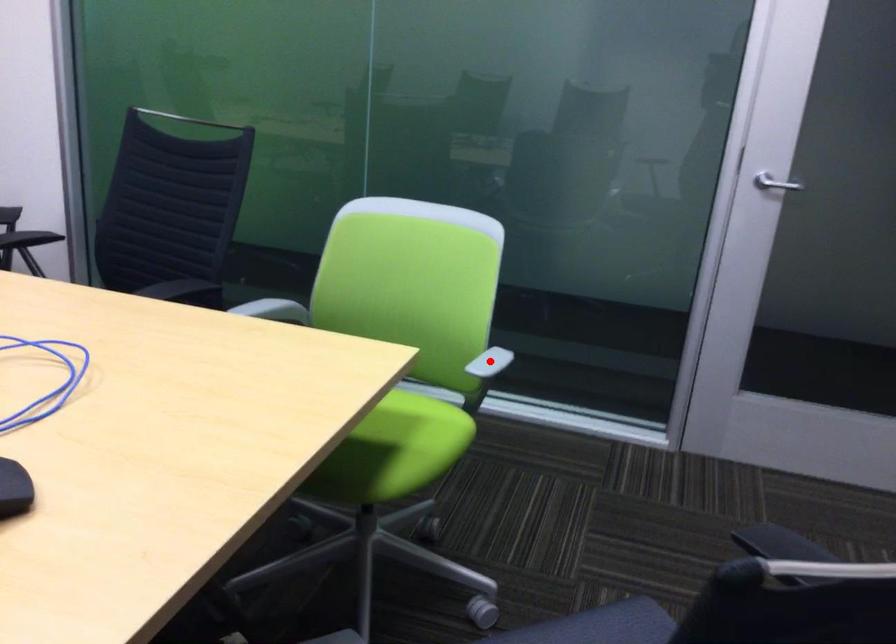
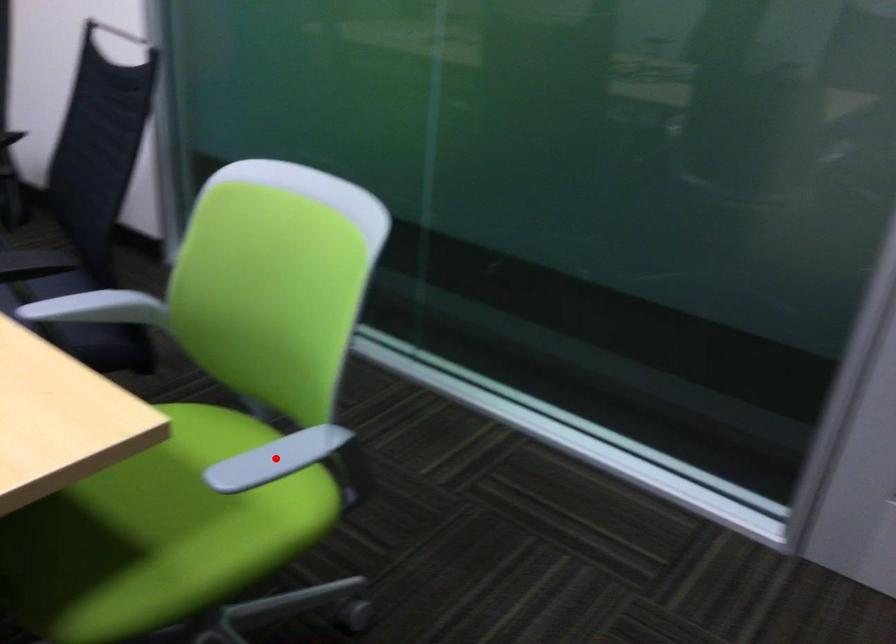
In the scene shown: I am providing you with two images of the same scene from different viewpoints. A red point is marked on the first image and another point is marked on the second image. Is the marked point in image1 the same physical position as the marked point in image2?

Yes